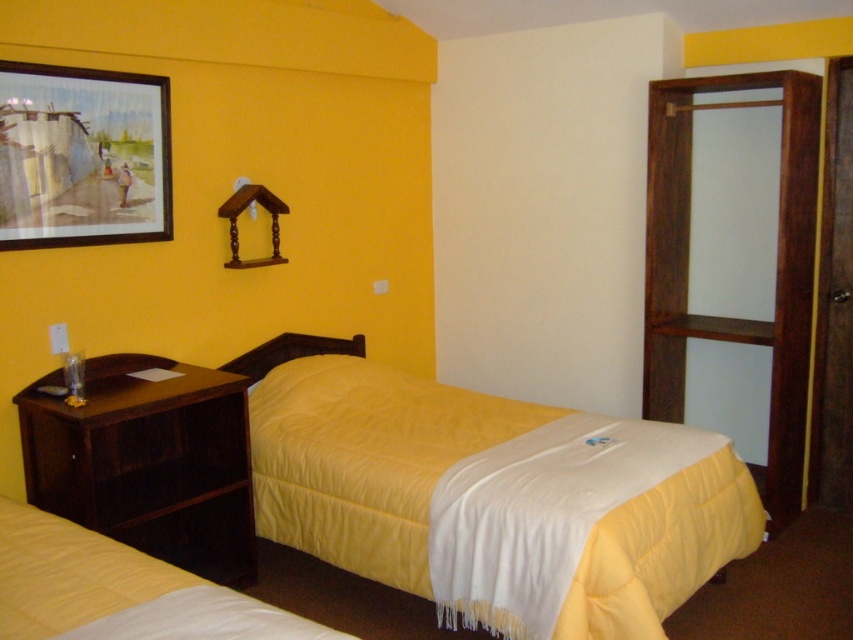
Question: Estimate the real-world distances between objects in this image. Which object is farther from the yellow quilted bedcover at lower left?

Choices:
 (A) yellow fabric bed at center
 (B) dark wood dresser at lower left
 (C) wooden framed painting at upper left

Answer: (C)

Question: Does yellow fabric bed at center have a greater width compared to wooden framed painting at upper left?

Choices:
 (A) yes
 (B) no

Answer: (A)

Question: Which is nearer to the dark wood dresser at lower left?

Choices:
 (A) wooden wardrobe at right
 (B) yellow quilted bedcover at lower left

Answer: (B)

Question: Where is dark wood dresser at lower left located in relation to wooden framed painting at upper left in the image?

Choices:
 (A) above
 (B) below

Answer: (B)

Question: Which point is closer to the camera?

Choices:
 (A) wooden wardrobe at right
 (B) yellow quilted bedcover at lower left

Answer: (B)

Question: Does dark wood dresser at lower left come in front of wooden framed painting at upper left?

Choices:
 (A) yes
 (B) no

Answer: (A)